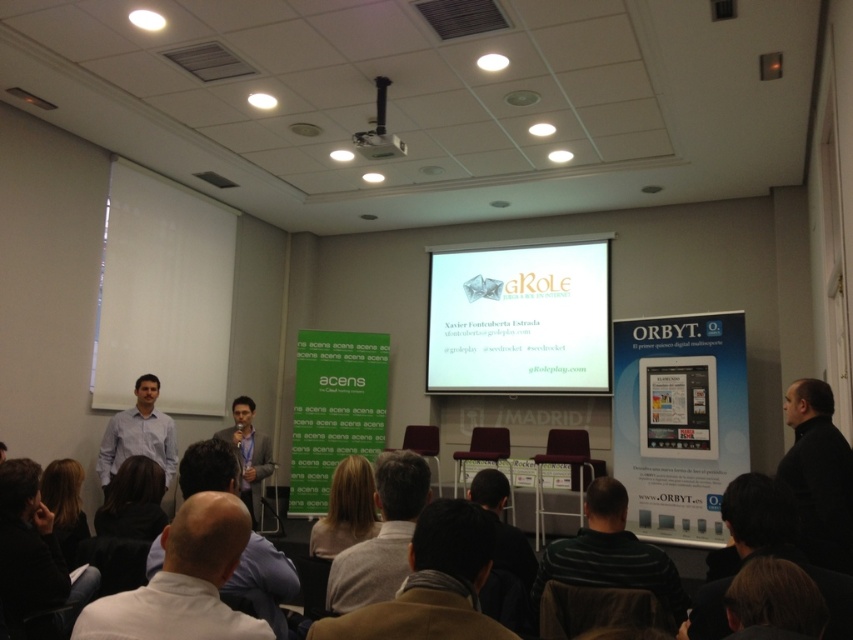
Is striped sweater at center positioned behind white shirt at center?

Yes, striped sweater at center is further from the viewer.

Which is in front, point (611, 497) or point (283, 566)?

Point (283, 566)

Where is `striped sweater at center`? The image size is (853, 640). striped sweater at center is located at coordinates (610, 554).

Find the location of a particular element. striped sweater at center is located at coordinates (610, 554).

Is black matte jacket at right taller than black fabric shirt at lower center?

Yes.

Who is more distant from viewer, (799, 433) or (497, 529)?

The point (799, 433) is behind.

Is point (840, 563) behind point (511, 561)?

That is True.

At what (x,y) coordinates should I click in order to perform the action: click on black matte jacket at right. Please return your answer as a coordinate pair (x, y). Looking at the image, I should click on (817, 474).

Who is higher up, light brown leather jacket at center or white plastic projector at upper center?

Positioned higher is white plastic projector at upper center.

Is point (248, 460) positioned in front of point (381, 154)?

No, it is behind (381, 154).

Where is `light brown leather jacket at center`? The image size is (853, 640). light brown leather jacket at center is located at coordinates (248, 451).

Where is `light brown leather jacket at center`? The width and height of the screenshot is (853, 640). light brown leather jacket at center is located at coordinates (248, 451).